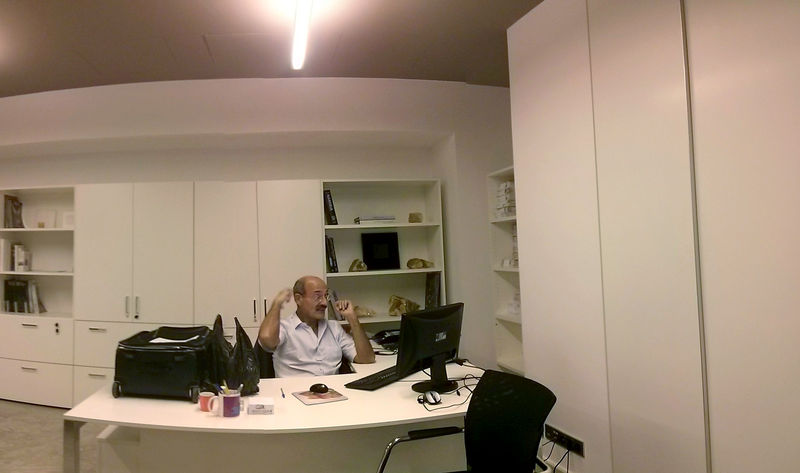
At what (x,y) coordinates should I click in order to perform the action: click on black chair. Please return your answer as a coordinate pair (x, y). Looking at the image, I should click on (522, 430).